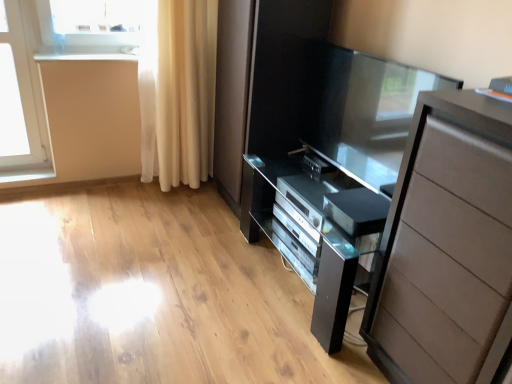
What is the approximate width of satin black tv at center, the 1th appliance viewed from the back?

5.79 inches.

Measure the distance between point (325, 100) and camera.

Point (325, 100) is 7.17 feet away from camera.

Measure the distance between point (334, 318) and camera.

Point (334, 318) and camera are 1.70 meters apart from each other.

Describe the element at coordinates (357, 210) in the screenshot. Image resolution: width=512 pixels, height=384 pixels. I see `satin silver dvd player at lower center, the 1th appliance when ordered from bottom to top` at that location.

Locate an element on the screen. The width and height of the screenshot is (512, 384). matte brown chest of drawers at right is located at coordinates (446, 247).

Image resolution: width=512 pixels, height=384 pixels. What do you see at coordinates (22, 97) in the screenshot?
I see `white glass window at upper left` at bounding box center [22, 97].

Identify the location of satin black tv at center, the 1th appliance viewed from the back. This screenshot has width=512, height=384. [316, 164].

Is white glossy window sill at upper left with black glass tv stand at center?

white glossy window sill at upper left and black glass tv stand at center are not in contact.

I want to click on computer desk on the right of white glossy window sill at upper left, so click(x=315, y=231).

Is white glossy window sill at upper left positioned in front of black glass tv stand at center?

No.

From the image's perspective, is white glossy window sill at upper left on top of black glass tv stand at center?

Yes.

In the image, is satin silver dvd player at lower center, the 1th appliance from the front, positioned in front of or behind white glossy window sill at upper left?

In the image, satin silver dvd player at lower center, the 1th appliance from the front, appears in front of white glossy window sill at upper left.

Between satin silver dvd player at lower center, arranged as the 2th appliance when viewed from the top, and white glossy window sill at upper left, which one has larger width?

satin silver dvd player at lower center, arranged as the 2th appliance when viewed from the top, is wider.

Does satin silver dvd player at lower center, the 1th appliance when ordered from bottom to top, have a larger size compared to white glossy window sill at upper left?

Correct, satin silver dvd player at lower center, the 1th appliance when ordered from bottom to top, is larger in size than white glossy window sill at upper left.

Is black glass tv stand at center aimed at light beige sheer curtain at left?

No, black glass tv stand at center does not turn towards light beige sheer curtain at left.

In terms of width, does black glass tv stand at center look wider or thinner when compared to light beige sheer curtain at left?

Considering their sizes, black glass tv stand at center looks broader than light beige sheer curtain at left.

Who is taller, black glass tv stand at center or light beige sheer curtain at left?

light beige sheer curtain at left.

Does matte brown chest of drawers at right appear on the left side of black glass tv stand at center?

No, matte brown chest of drawers at right is not to the left of black glass tv stand at center.

Is matte brown chest of drawers at right not within black glass tv stand at center?

Yes, matte brown chest of drawers at right is not within black glass tv stand at center.

Which is closer to the camera, (379, 332) or (335, 215)?

The point (379, 332) is closer.

Measure the distance between satin black tv at center, which ranks as the 2th appliance in front-to-back order, and light beige sheer curtain at left.

satin black tv at center, which ranks as the 2th appliance in front-to-back order, is 38.17 inches away from light beige sheer curtain at left.

This screenshot has height=384, width=512. What are the coordinates of `the 2nd appliance located beneath the light beige sheer curtain at left (from a real-world perspective)` in the screenshot? It's located at (316, 164).

Does satin black tv at center, which is the 1th appliance in top-to-bottom order, have a larger size compared to light beige sheer curtain at left?

No, satin black tv at center, which is the 1th appliance in top-to-bottom order, is not bigger than light beige sheer curtain at left.

From the picture: From the image's perspective, between satin black tv at center, which ranks as the 2th appliance in front-to-back order, and light beige sheer curtain at left, which one is located above?

light beige sheer curtain at left is shown above in the image.

Can you confirm if satin black tv at center, the 1th appliance viewed from the back, is shorter than white glass window at upper left?

Correct, satin black tv at center, the 1th appliance viewed from the back, is not as tall as white glass window at upper left.

Does satin black tv at center, the second appliance from the bottom, have a lesser width compared to white glass window at upper left?

No, satin black tv at center, the second appliance from the bottom, is not thinner than white glass window at upper left.

Does satin black tv at center, which is the 1th appliance in top-to-bottom order, turn towards white glass window at upper left?

No, satin black tv at center, which is the 1th appliance in top-to-bottom order, is not oriented towards white glass window at upper left.

Which point is more forward, (318, 165) or (39, 104)?

The point (318, 165) is closer to the camera.

Considering the relative sizes of transparent glass screen door at center and satin black tv at center, the 1th appliance viewed from the back, in the image provided, is transparent glass screen door at center shorter than satin black tv at center, the 1th appliance viewed from the back,?

No, transparent glass screen door at center is not shorter than satin black tv at center, the 1th appliance viewed from the back.

How different are the orientations of transparent glass screen door at center and satin black tv at center, which is the 1th appliance in top-to-bottom order, in degrees?

3.34 degrees separate the facing orientations of transparent glass screen door at center and satin black tv at center, which is the 1th appliance in top-to-bottom order.

From the image's perspective, which is below, transparent glass screen door at center or satin black tv at center, which ranks as the 2th appliance in front-to-back order?

satin black tv at center, which ranks as the 2th appliance in front-to-back order, appears lower in the image.

Can you confirm if transparent glass screen door at center is smaller than satin black tv at center, the second appliance from the bottom?

No, transparent glass screen door at center is not smaller than satin black tv at center, the second appliance from the bottom.

You are a GUI agent. You are given a task and a screenshot of the screen. Output one action in this format:
    pyautogui.click(x=<x>, y=<y>)
    Task: Click on the window sill on the left side of black glass tv stand at center
    
    Given the screenshot: What is the action you would take?
    pyautogui.click(x=87, y=53)

At what (x,y) coordinates should I click in order to perform the action: click on window sill lying above the satin silver dvd player at lower center, arranged as the 2th appliance when viewed from the top (from the image's perspective). Please return your answer as a coordinate pair (x, y). The image size is (512, 384). Looking at the image, I should click on (87, 53).

Based on their spatial positions, is light beige sheer curtain at left or matte brown chest of drawers at right further from transparent glass screen door at center?

light beige sheer curtain at left is further to transparent glass screen door at center.

Based on the photo, when comparing their distances from transparent glass screen door at center, does white glass window at upper left or black glass tv stand at center seem closer?

black glass tv stand at center is positioned closer to the anchor transparent glass screen door at center.

Consider the image. From the image, which object appears to be nearer to white glossy window sill at upper left, light beige sheer curtain at left or matte brown chest of drawers at right?

The object closer to white glossy window sill at upper left is light beige sheer curtain at left.

In the scene shown: Considering their positions, is light beige sheer curtain at left positioned closer to white glass window at upper left than matte brown chest of drawers at right?

Among the two, light beige sheer curtain at left is located nearer to white glass window at upper left.

From the image, which object appears to be farther from white glass window at upper left, satin silver dvd player at lower center, the 2th appliance in the back-to-front sequence, or matte brown chest of drawers at right?

matte brown chest of drawers at right is positioned further to the anchor white glass window at upper left.

From the image, which object appears to be nearer to white glossy window sill at upper left, satin silver dvd player at lower center, arranged as the 2th appliance when viewed from the top, or black glass tv stand at center?

black glass tv stand at center lies closer to white glossy window sill at upper left than the other object.

From the image, which object appears to be farther from white glass window at upper left, light beige sheer curtain at left or satin black tv at center, which ranks as the 2th appliance in front-to-back order?

satin black tv at center, which ranks as the 2th appliance in front-to-back order.

Estimate the real-world distances between objects in this image. Which object is closer to white glass window at upper left, white glossy window sill at upper left or satin black tv at center, which ranks as the 2th appliance in front-to-back order?

The object closer to white glass window at upper left is white glossy window sill at upper left.

Image resolution: width=512 pixels, height=384 pixels. I want to click on window sill between white glass window at upper left and black glass tv stand at center in the horizontal direction, so (87, 53).

Where is `screen door located between white glass window at upper left and matte brown chest of drawers at right in the left-right direction`? screen door located between white glass window at upper left and matte brown chest of drawers at right in the left-right direction is located at coordinates (365, 111).

You are a GUI agent. You are given a task and a screenshot of the screen. Output one action in this format:
    pyautogui.click(x=<x>, y=<y>)
    Task: Click on the window sill situated between white glass window at upper left and transparent glass screen door at center from left to right
    The height and width of the screenshot is (384, 512).
    Given the screenshot: What is the action you would take?
    pyautogui.click(x=87, y=53)

I want to click on computer desk between white glass window at upper left and matte brown chest of drawers at right from left to right, so click(x=315, y=231).